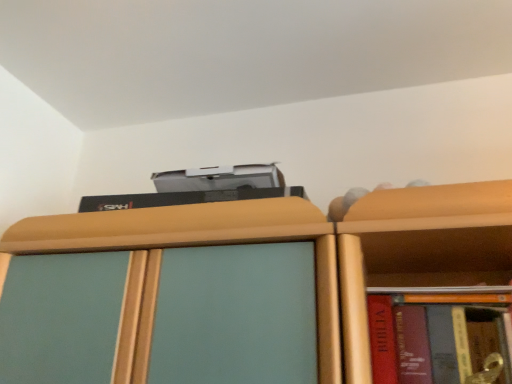
You are a GUI agent. You are given a task and a screenshot of the screen. Output one action in this format:
    pyautogui.click(x=<x>, y=<y>)
    Task: Click on the free space above red leather book at lower right (from a real-world perspective)
    
    Given the screenshot: What is the action you would take?
    pyautogui.click(x=450, y=289)